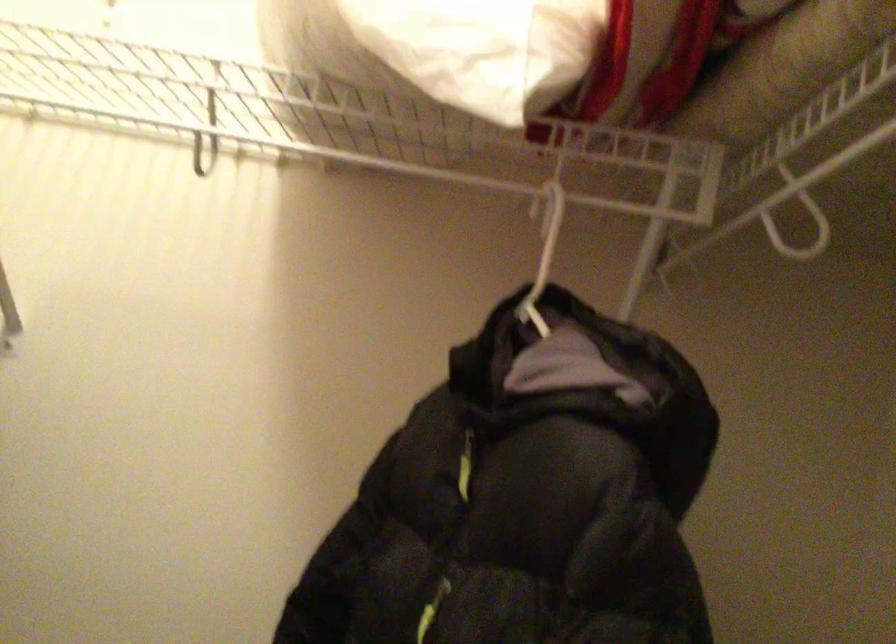
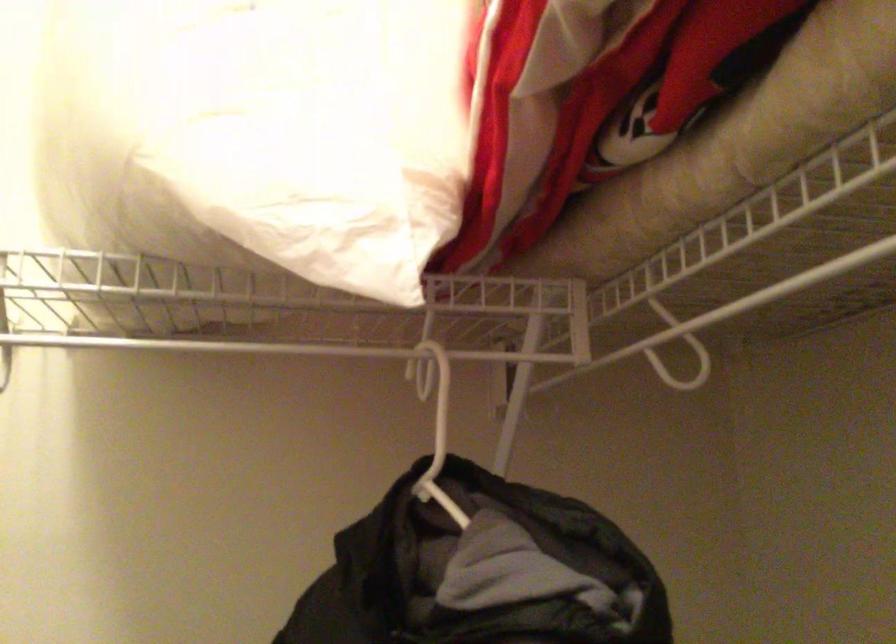
Which direction would the cameraman need to move to produce the second image?

The movement direction of the cameraman is left, forward.